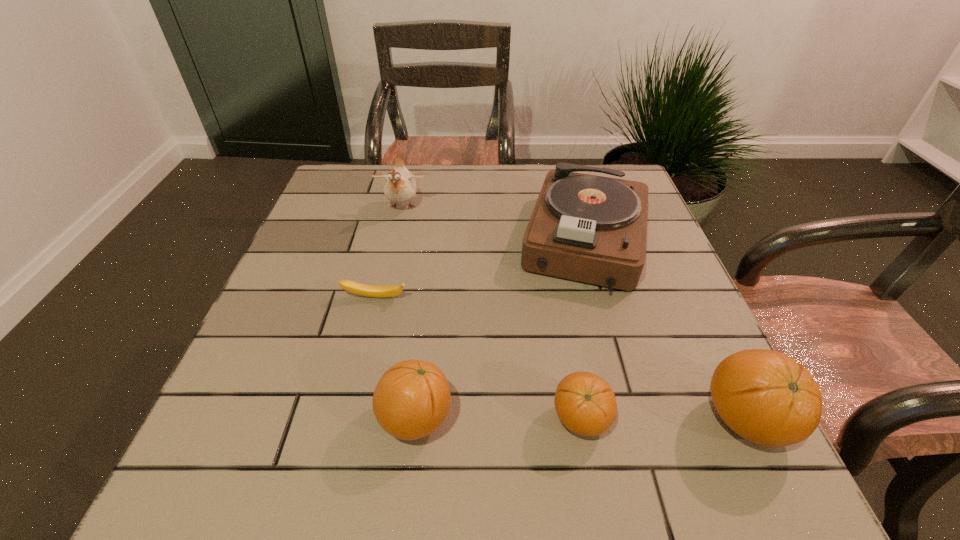
Where is `free point located on the left of the record player`? free point located on the left of the record player is located at coordinates (437, 240).

Find the location of a particular element. vacant space situated at the beak of the bird is located at coordinates pyautogui.click(x=373, y=336).

Where is `vacant region located at the stem of the banana`? vacant region located at the stem of the banana is located at coordinates (370, 321).

This screenshot has height=540, width=960. I want to click on record player positioned at the far edge, so pos(593,229).

Find the location of a particular element. bird present at the far edge is located at coordinates (400, 187).

You are a GUI agent. You are given a task and a screenshot of the screen. Output one action in this format:
    pyautogui.click(x=<x>, y=<y>)
    Task: Click on the bird that is at the left edge
    The height and width of the screenshot is (540, 960).
    Given the screenshot: What is the action you would take?
    pyautogui.click(x=400, y=187)

Where is `banana that is at the left edge`? The width and height of the screenshot is (960, 540). banana that is at the left edge is located at coordinates (360, 289).

Where is `orange that is at the right edge`? orange that is at the right edge is located at coordinates (766, 397).

Locate an element on the screen. The image size is (960, 540). record player that is at the right edge is located at coordinates (593, 229).

This screenshot has height=540, width=960. I want to click on object present at the far left corner, so click(x=400, y=187).